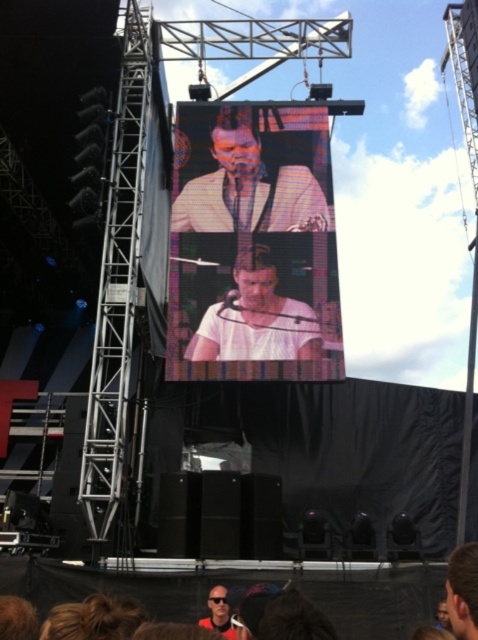
You are a photographer at the event and need to adjust your camera focus. Which object between the brown hair at lower center and the matte black sunglasses at lower center is taller?

The brown hair at lower center is taller than the matte black sunglasses at lower center according to the description.

You are a photographer positioned at the back of the concert venue. You want to capture a clear photo of the smooth white shirt at center. Considering the distance, is it feasible to take a clear photo without using a zoom lens?

The smooth white shirt at center is 41.08 meters away from the viewer. Without a zoom lens, capturing a clear photo from this distance would be challenging due to the limited focal range of standard lenses. A zoom lens would be necessary to magnify the subject sufficiently.